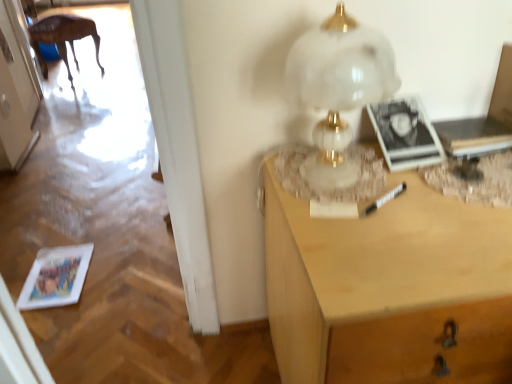
Image resolution: width=512 pixels, height=384 pixels. Find the location of `free area below wooden table at left (from a real-world perspective)`. free area below wooden table at left (from a real-world perspective) is located at coordinates (76, 73).